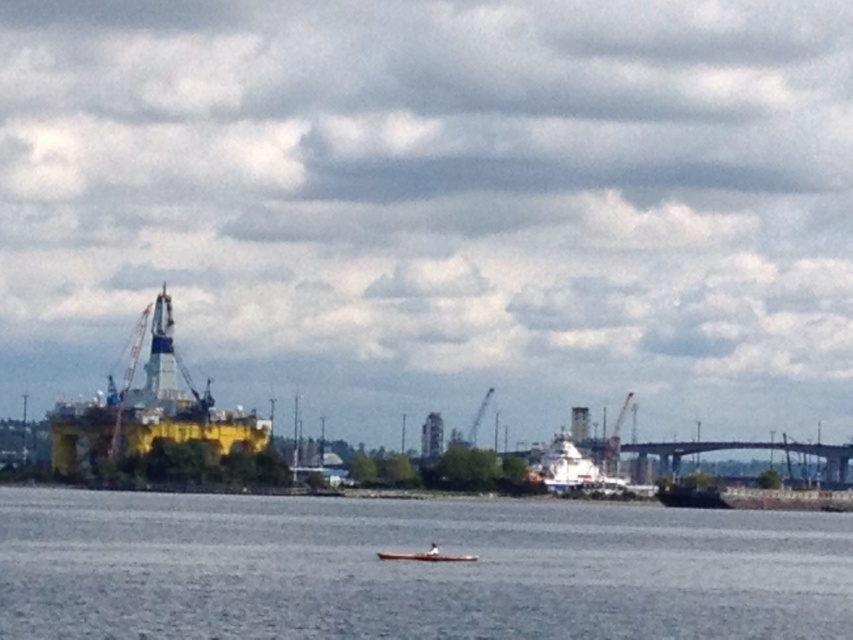
Question: Which object appears closest to the camera in this image?

Choices:
 (A) metallic gray crane at center right
 (B) yellow matte oil rig at left
 (C) wooden canoe at center

Answer: (C)

Question: Can you confirm if yellow matte oil rig at left is wider than wooden canoe at center?

Choices:
 (A) yes
 (B) no

Answer: (A)

Question: Which point is farther to the camera?

Choices:
 (A) metallic gray crane at center right
 (B) gray water at center
 (C) yellow matte oil rig at left
 (D) wooden canoe at center

Answer: (A)

Question: Does yellow matte oil rig at left appear on the left side of metallic gray crane at center right?

Choices:
 (A) no
 (B) yes

Answer: (B)

Question: Is gray water at center below yellow matte oil rig at left?

Choices:
 (A) yes
 (B) no

Answer: (A)

Question: Among these objects, which one is nearest to the camera?

Choices:
 (A) wooden canoe at center
 (B) metallic gray crane at center right

Answer: (A)